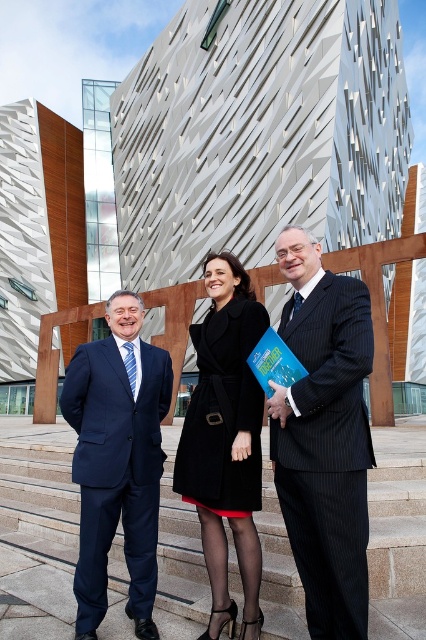
Is navy blue suit at left above black wool coat at center?

No, navy blue suit at left is not above black wool coat at center.

Locate an element on the screen. The width and height of the screenshot is (426, 640). navy blue suit at left is located at coordinates (118, 460).

Can you confirm if smooth stone stairs at center is shorter than black wool coat at center?

Correct, smooth stone stairs at center is not as tall as black wool coat at center.

Is smooth stone stairs at center further to camera compared to black wool coat at center?

That is False.

In order to click on smooth stone stairs at center in this screenshot , I will do `click(397, 545)`.

Is pinstriped suit at center taller than navy blue suit at left?

Yes.

Can you confirm if pinstriped suit at center is smaller than navy blue suit at left?

No, pinstriped suit at center is not smaller than navy blue suit at left.

This screenshot has width=426, height=640. In order to click on pinstriped suit at center in this screenshot , I will do `click(325, 436)`.